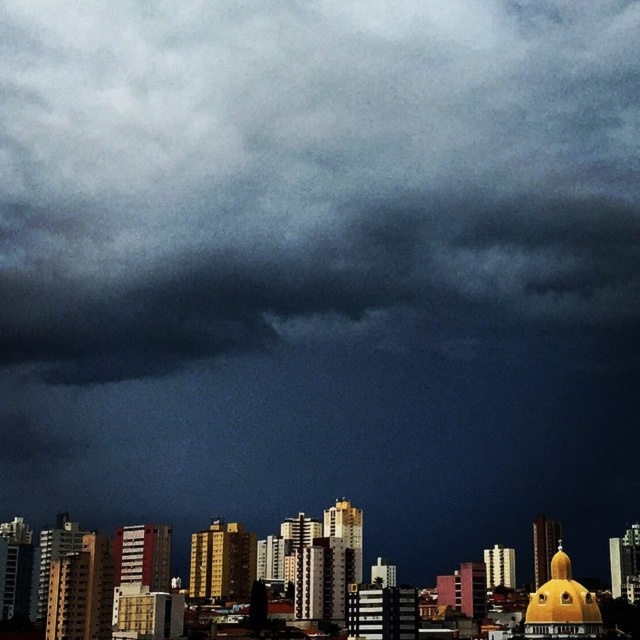
Does dark gray cloud at upper center have a lesser width compared to dark gray cloud at center?

Incorrect, dark gray cloud at upper center's width is not less than dark gray cloud at center's.

Describe the element at coordinates (312, 164) in the screenshot. I see `dark gray cloud at upper center` at that location.

This screenshot has height=640, width=640. I want to click on dark gray cloud at upper center, so click(x=312, y=164).